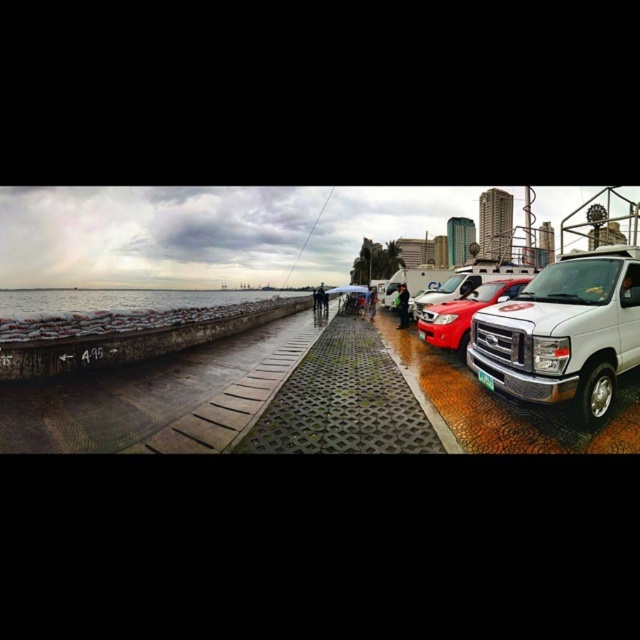
You are standing on the concrete textured pavement at lower left and want to reach the matte white van at right. Which direction should you move to get there?

You should move upwards to reach the matte white van at right because the concrete textured pavement at lower left is located below it.

You are standing on the walkway and notice two green items in the scene. One is the green textured pavement at center and the other is the green plastic license plate at center. Which of these two items is positioned lower from your viewpoint?

The green textured pavement at center is located below the green plastic license plate at center, so the green textured pavement at center is positioned lower.

You are standing at the water edge in the waterfront scene. You want to walk to the green textured pavement at center. Which direction should you head?

The green textured pavement at center is located at point (x=348, y=401) in the image, so you should head towards the center of the image to reach it.